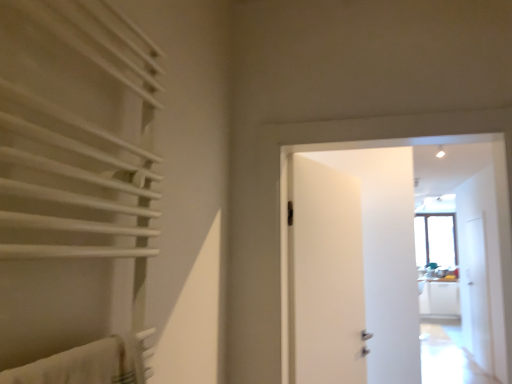
Question: Is white matte towel rack at left smaller than transparent glass screen door at right?

Choices:
 (A) yes
 (B) no

Answer: (A)

Question: Is white matte towel rack at left looking in the opposite direction of transparent glass screen door at right?

Choices:
 (A) no
 (B) yes

Answer: (A)

Question: Considering the relative sizes of white matte towel rack at left and transparent glass screen door at right in the image provided, is white matte towel rack at left bigger than transparent glass screen door at right?

Choices:
 (A) no
 (B) yes

Answer: (A)

Question: Is white matte towel rack at left positioned before transparent glass screen door at right?

Choices:
 (A) no
 (B) yes

Answer: (B)

Question: Can you confirm if white matte towel rack at left is wider than transparent glass screen door at right?

Choices:
 (A) no
 (B) yes

Answer: (B)

Question: Is white matte towel rack at left not inside transparent glass screen door at right?

Choices:
 (A) no
 (B) yes

Answer: (B)

Question: Considering the relative sizes of white matte door at center and white matte towel rack at left in the image provided, is white matte door at center thinner than white matte towel rack at left?

Choices:
 (A) yes
 (B) no

Answer: (B)

Question: Is white matte door at center turned away from white matte towel rack at left?

Choices:
 (A) yes
 (B) no

Answer: (B)

Question: Is white matte door at center smaller than white matte towel rack at left?

Choices:
 (A) yes
 (B) no

Answer: (B)

Question: Would you consider white matte door at center to be distant from white matte towel rack at left?

Choices:
 (A) no
 (B) yes

Answer: (A)

Question: Is white matte door at center positioned beyond the bounds of white matte towel rack at left?

Choices:
 (A) no
 (B) yes

Answer: (B)

Question: Can you confirm if white matte door at center is positioned to the right of white matte towel rack at left?

Choices:
 (A) yes
 (B) no

Answer: (A)

Question: From a real-world perspective, does white matte door at center stand above transparent glass screen door at right?

Choices:
 (A) yes
 (B) no

Answer: (A)